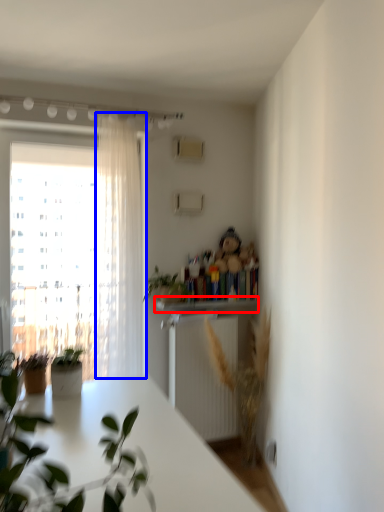
Question: Which object is closer to the camera taking this photo, window sill (highlighted by a red box) or curtain (highlighted by a blue box)?

Choices:
 (A) window sill
 (B) curtain

Answer: (B)